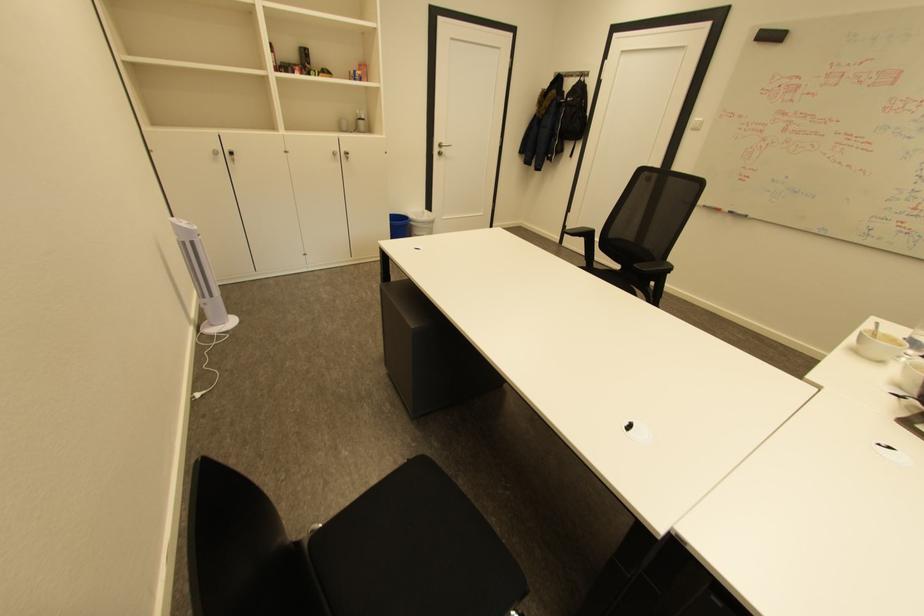
Which object does [900,330] point to?

This point indicates the metal spoon.